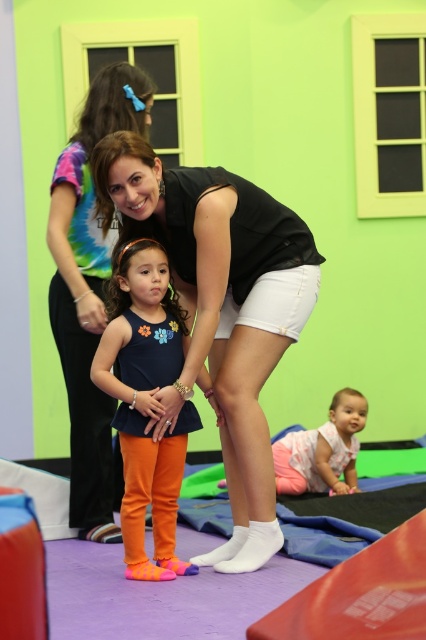
Is black matte tank top at center shorter than pink cotton baby at lower center?

No.

Which is below, black matte tank top at center or pink cotton baby at lower center?

pink cotton baby at lower center is below.

Does point (276, 326) lie in front of point (336, 394)?

Yes, point (276, 326) is in front of point (336, 394).

Locate an element on the screen. black matte tank top at center is located at coordinates (221, 308).

Who is more forward, (97,225) or (132,333)?

Point (132,333) is more forward.

Who is more forward, [121,88] or [158,476]?

Point [158,476] is more forward.

Identify the location of matte black tank top at center. (89, 294).

This screenshot has width=426, height=640. Identify the location of black matte tank top at center. (221, 308).

Does black matte tank top at center have a greater height compared to matte black tank top at center?

No, black matte tank top at center is not taller than matte black tank top at center.

The width and height of the screenshot is (426, 640). Describe the element at coordinates (221, 308) in the screenshot. I see `black matte tank top at center` at that location.

In order to click on black matte tank top at center in this screenshot , I will do `click(221, 308)`.